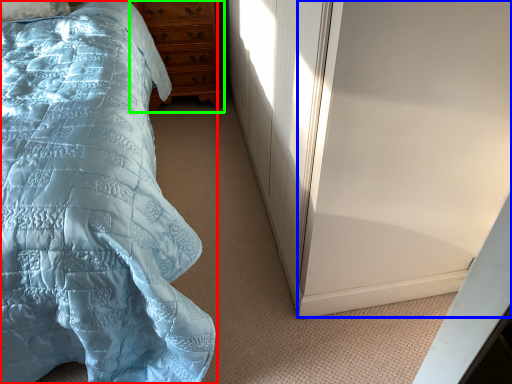
Question: Estimate the real-world distances between objects in this image. Which object is closer to bed (highlighted by a red box), screen door (highlighted by a blue box) or chest of drawers (highlighted by a green box)?

Choices:
 (A) screen door
 (B) chest of drawers

Answer: (A)